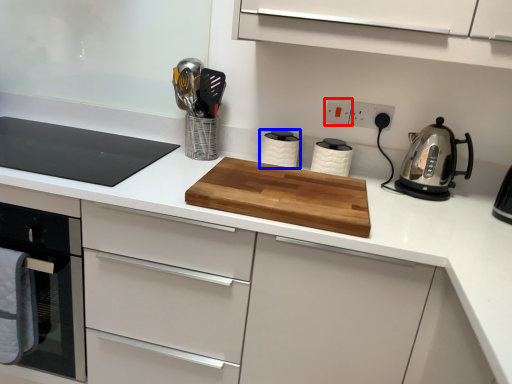
Question: Which point is closer to the camera, electric outlet (highlighted by a red box) or kitchen appliance (highlighted by a blue box)?

Choices:
 (A) electric outlet
 (B) kitchen appliance

Answer: (B)